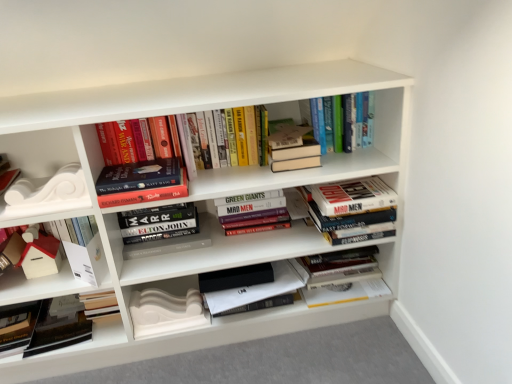
Question: From a real-world perspective, is white matte decorative molding at lower left, which is the first paperback book from right to left, physically above white matte paper at lower left, the 2th paperback book when ordered from left to right?

Choices:
 (A) yes
 (B) no

Answer: (B)

Question: Can you confirm if white matte decorative molding at lower left, which is the first paperback book from right to left, is thinner than white matte paper at lower left, the 2th paperback book when ordered from left to right?

Choices:
 (A) yes
 (B) no

Answer: (B)

Question: Is white matte decorative molding at lower left, which appears as the 3th paperback book when viewed from the left, bigger than white matte paper at lower left, the 2th paperback book when ordered from left to right?

Choices:
 (A) yes
 (B) no

Answer: (A)

Question: Is white matte decorative molding at lower left, which is the first paperback book from right to left, to the right of white matte paper at lower left, the 2th paperback book when ordered from left to right, from the viewer's perspective?

Choices:
 (A) no
 (B) yes

Answer: (B)

Question: Does white matte decorative molding at lower left, which is the first paperback book from right to left, have a lesser height compared to white matte paper at lower left, arranged as the second paperback book when viewed from the right?

Choices:
 (A) yes
 (B) no

Answer: (A)

Question: Visually, is hardcover books at upper center, which ranks as the third book in right-to-left order, positioned to the left or to the right of hardcover book at center, which is counted as the eighth book, starting from the right?

Choices:
 (A) left
 (B) right

Answer: (B)

Question: Is hardcover books at upper center, the eighth book in the left-to-right sequence, inside the boundaries of hardcover book at center, the third book viewed from the left, or outside?

Choices:
 (A) inside
 (B) outside

Answer: (B)

Question: From a real-world perspective, is hardcover books at upper center, which ranks as the third book in right-to-left order, above or below hardcover book at center, the third book viewed from the left?

Choices:
 (A) below
 (B) above

Answer: (B)

Question: Considering their positions, is hardcover books at upper center, which ranks as the third book in right-to-left order, located in front of or behind hardcover book at center, which is counted as the eighth book, starting from the right?

Choices:
 (A) behind
 (B) front

Answer: (A)

Question: Is point (11, 190) closer or farther from the camera than point (4, 307)?

Choices:
 (A) closer
 (B) farther

Answer: (A)

Question: From the image's perspective, is white matte decorative element at left, which ranks as the second shelf in bottom-to-top order, above or below matte black book at lower left, the 3th paperback book positioned from the right?

Choices:
 (A) above
 (B) below

Answer: (A)

Question: In terms of height, does white matte decorative element at left, which appears as the second shelf when viewed from the right, look taller or shorter compared to matte black book at lower left, the 3th paperback book positioned from the right?

Choices:
 (A) short
 (B) tall

Answer: (B)

Question: In terms of size, does white matte decorative element at left, positioned as the 1th shelf in top-to-bottom order, appear bigger or smaller than matte black book at lower left, the 3th paperback book positioned from the right?

Choices:
 (A) big
 (B) small

Answer: (B)

Question: Considering the positions of hardcover books at center, which ranks as the sixth book in left-to-right order, and white matte house at left, the first book from the left, in the image, is hardcover books at center, which ranks as the sixth book in left-to-right order, bigger or smaller than white matte house at left, the first book from the left,?

Choices:
 (A) small
 (B) big

Answer: (B)

Question: Looking at their shapes, would you say hardcover books at center, the fifth book when ordered from right to left, is wider or thinner than white matte house at left, the first book from the left?

Choices:
 (A) thin
 (B) wide

Answer: (B)